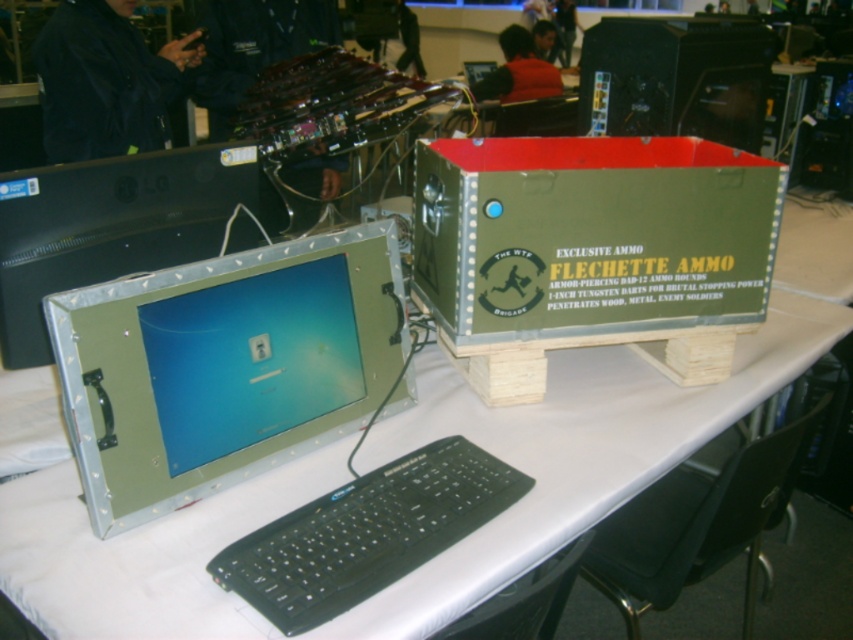
Which is more to the right, olive green cardboard box at center or metallic green monitor at center?

olive green cardboard box at center is more to the right.

Can you confirm if olive green cardboard box at center is positioned to the left of metallic green monitor at center?

Incorrect, olive green cardboard box at center is not on the left side of metallic green monitor at center.

Does point (450, 276) come behind point (117, 401)?

Yes, point (450, 276) is farther from viewer.

Locate an element on the screen. olive green cardboard box at center is located at coordinates (590, 252).

Does metallic green computer desk at center appear under black plastic keyboard at lower center?

Actually, metallic green computer desk at center is above black plastic keyboard at lower center.

Which of these two, metallic green computer desk at center or black plastic keyboard at lower center, stands shorter?

black plastic keyboard at lower center is shorter.

Who is more forward, [38,512] or [486,488]?

Point [38,512] is in front.

In order to click on metallic green computer desk at center in this screenshot , I will do `click(595, 433)`.

Who is more forward, (x=279, y=500) or (x=151, y=492)?

Positioned in front is point (x=151, y=492).

Who is more distant from viewer, (525,497) or (378,282)?

The point (378,282) is behind.

At what (x,y) coordinates should I click in order to perform the action: click on metallic green computer desk at center. Please return your answer as a coordinate pair (x, y). Looking at the image, I should click on (595, 433).

Find the location of `metallic green computer desk at center`. metallic green computer desk at center is located at coordinates point(595,433).